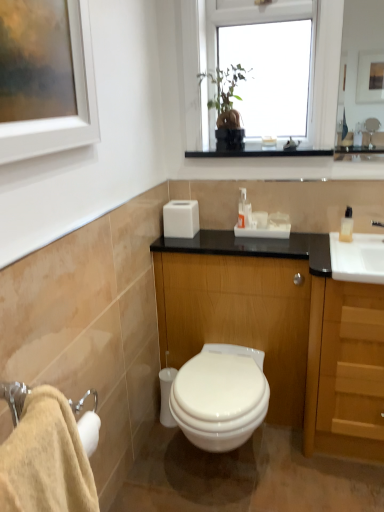
Locate an element on the screen. Image resolution: width=384 pixels, height=512 pixels. vacant point to the right of white glossy toilet at center is located at coordinates (304, 476).